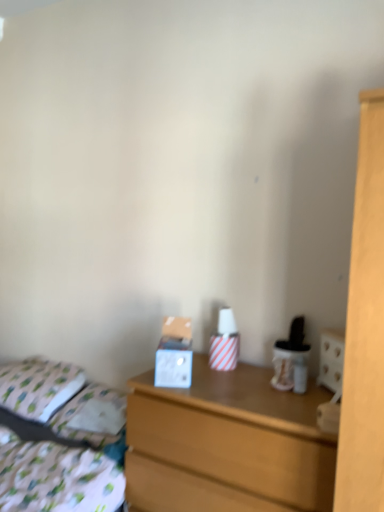
Locate an element on the screen. The width and height of the screenshot is (384, 512). free space above wooden chest of drawers at center (from a real-world perspective) is located at coordinates click(250, 384).